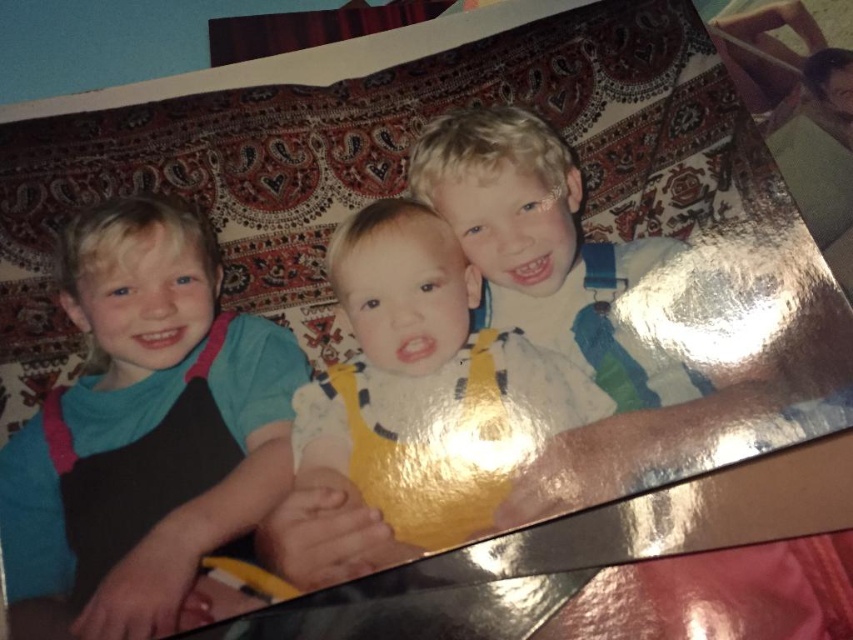
Can you confirm if blue cotton shirt at left is positioned to the right of matte blue overalls at center?

In fact, blue cotton shirt at left is to the left of matte blue overalls at center.

Is blue cotton shirt at left below matte blue overalls at center?

Correct, blue cotton shirt at left is located below matte blue overalls at center.

Locate an element on the screen. The image size is (853, 640). blue cotton shirt at left is located at coordinates (143, 433).

Is point (335, 273) positioned before point (637, 243)?

Yes, it is.

Between yellow fabric bib at center and matte blue overalls at center, which one has more height?

With more height is yellow fabric bib at center.

Between point (408, 349) and point (598, 268), which one is positioned behind?

The point (598, 268) is behind.

Identify the location of yellow fabric bib at center. The height and width of the screenshot is (640, 853). (421, 376).

Who is positioned more to the right, blue cotton shirt at left or yellow fabric bib at center?

From the viewer's perspective, yellow fabric bib at center appears more on the right side.

Is point (148, 420) more distant than point (466, 282)?

That is False.

Is point (111, 612) closer to viewer compared to point (537, 355)?

Yes, it is in front of point (537, 355).

Locate an element on the screen. The image size is (853, 640). blue cotton shirt at left is located at coordinates (143, 433).